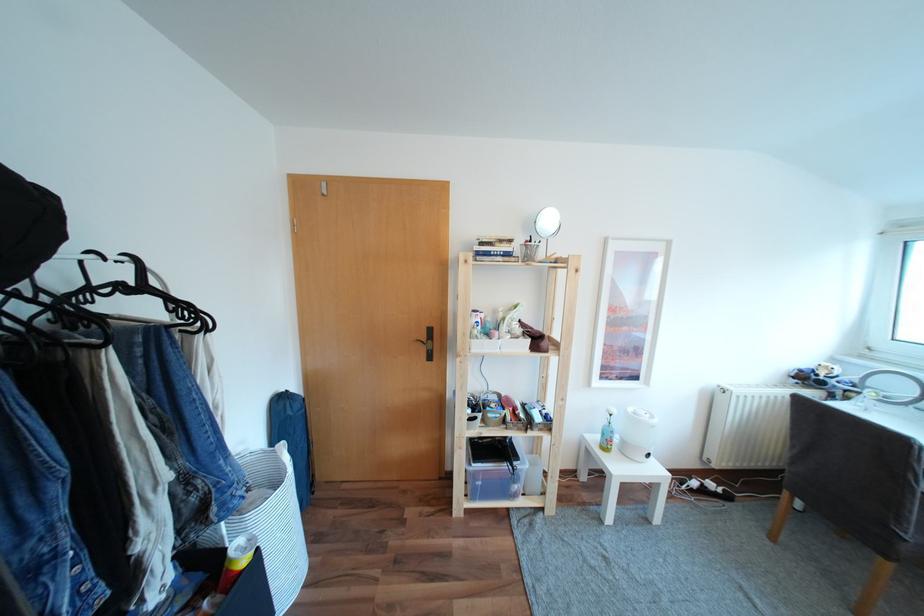
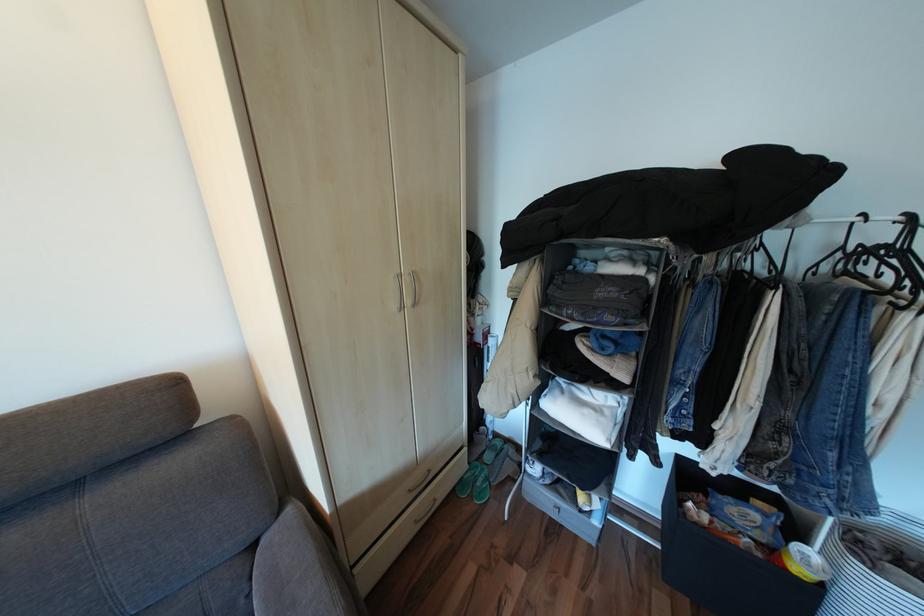
The point at (x=249, y=548) is marked in the first image. Where is the corresponding point in the second image?

(815, 554)